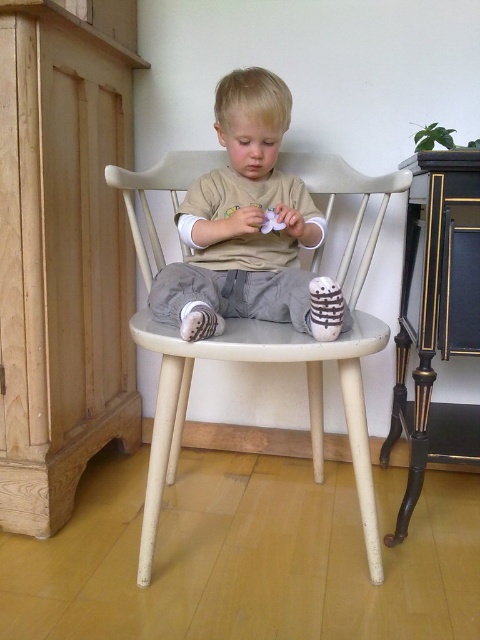
You are a photographer setting up a shot of the child and their belongings. You need to ensure that both the white striped socks at lower center and the white matte plush toy at center are in focus. Given that your camera can only focus on objects within a 30 cm depth range, will both items be in focus?

The white striped socks at lower center is closer to the viewer than the white matte plush toy at center. Since the camera can focus within a 30 cm depth range, both items will be in focus if the distance between them is within 30 cm. However, the exact distance isn

Looking at this image, the child is holding a small purple object. You need to place a matte beige shirt at center and a white matte plush toy at center on a shelf. Which one should you place first if the shelf has limited space and you want to place the larger item first?

The matte beige shirt at center is bigger than the white matte plush toy at center, so you should place the matte beige shirt at center first.

You are a tailor who needs to determine if the matte beige shirt at center can be placed inside the white painted wood chair at center. Based on their widths, can the shirt fit inside the chair?

The matte beige shirt at center has a lesser width compared to the white painted wood chair at center, so the shirt can fit inside the chair.